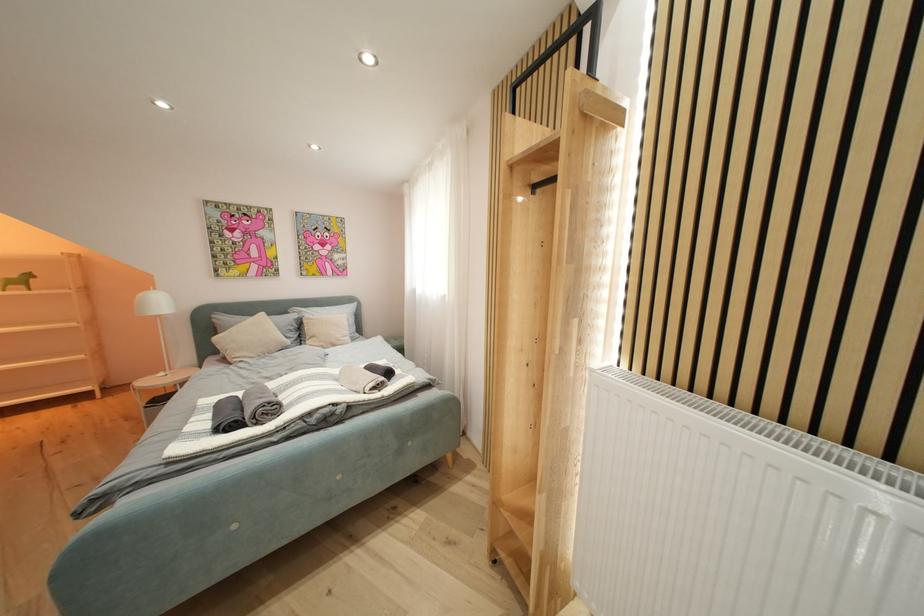
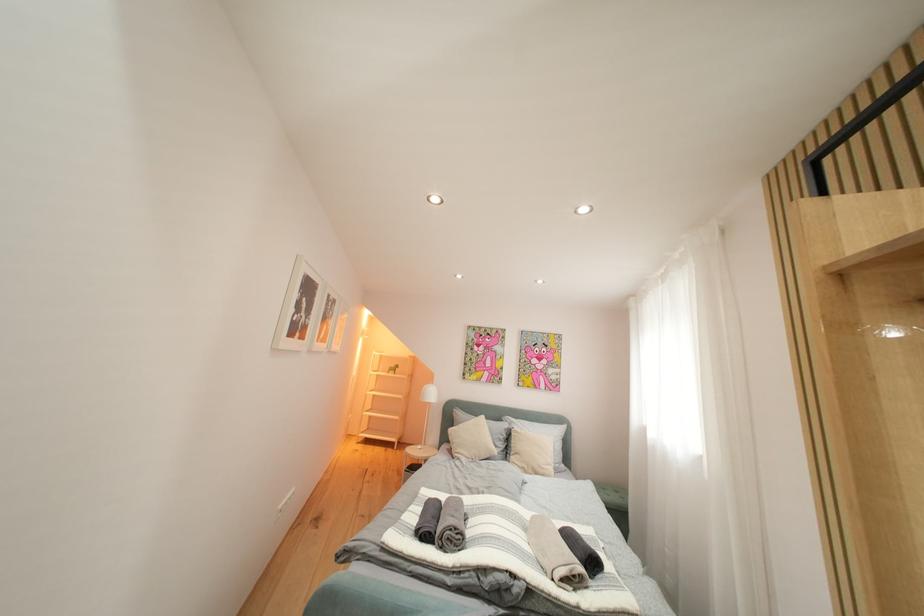
First-person continuous shooting, in which direction is the camera rotating?

The camera's rotation is toward left-up.